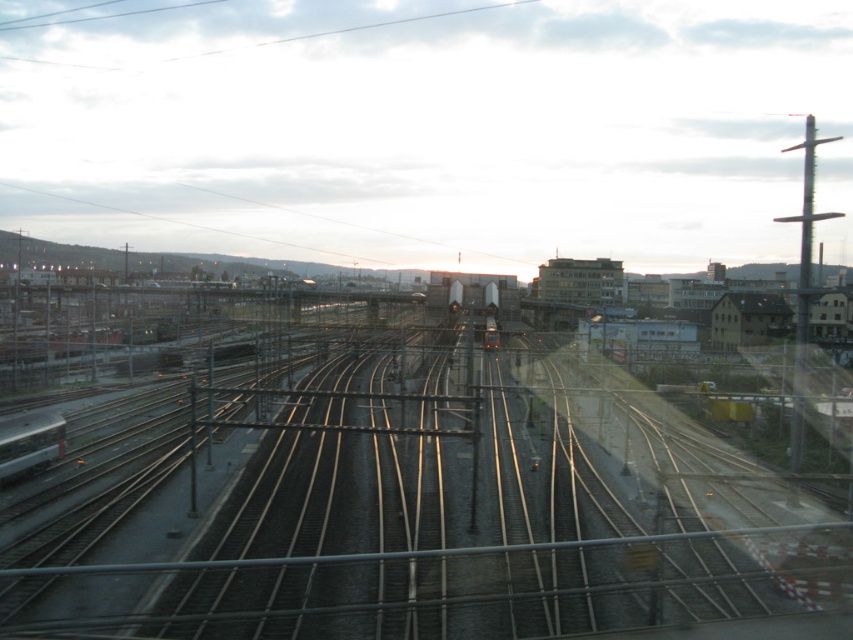
Is silver metallic train at left thinner than metallic silver train at lower left?

No.

Between point (27, 433) and point (51, 440), which one is positioned behind?

The point (51, 440) is more distant.

Locate an element on the screen. This screenshot has height=640, width=853. silver metallic train at left is located at coordinates (28, 442).

Which is above, metal tracks at center or silver metallic train at left?

metal tracks at center

Is metal tracks at center shorter than silver metallic train at left?

Incorrect, metal tracks at center's height does not fall short of silver metallic train at left's.

Is point (531, 442) less distant than point (9, 460)?

No, it is behind (9, 460).

This screenshot has height=640, width=853. I want to click on metal tracks at center, so click(457, 522).

Which is behind, point (45, 433) or point (489, 346)?

Point (489, 346)

Can you confirm if metallic silver train at lower left is positioned below metallic silver train at center?

Yes.

Locate an element on the screen. metallic silver train at lower left is located at coordinates (32, 444).